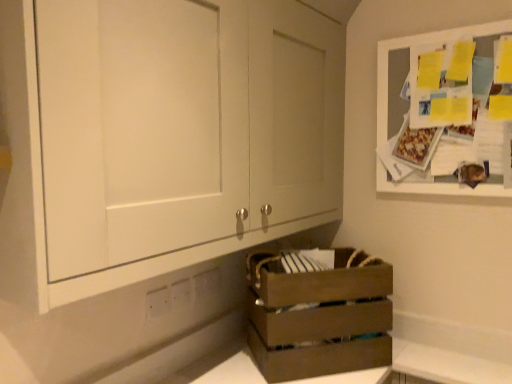
Question: Is brown wooden crate at lower center far away from white plastic electric outlet at lower center, which is the 3th electric outlet in left-to-right order?

Choices:
 (A) no
 (B) yes

Answer: (A)

Question: From a real-world perspective, does brown wooden crate at lower center stand above white plastic electric outlet at lower center, which is the 3th electric outlet in left-to-right order?

Choices:
 (A) yes
 (B) no

Answer: (B)

Question: Is brown wooden crate at lower center not within white plastic electric outlet at lower center, the first electric outlet positioned from the back?

Choices:
 (A) yes
 (B) no

Answer: (A)

Question: Can you confirm if brown wooden crate at lower center is positioned to the left of white plastic electric outlet at lower center, placed as the 1th electric outlet when sorted from right to left?

Choices:
 (A) yes
 (B) no

Answer: (B)

Question: Is brown wooden crate at lower center in contact with white plastic electric outlet at lower center, placed as the 1th electric outlet when sorted from right to left?

Choices:
 (A) yes
 (B) no

Answer: (B)

Question: Is brown wooden crate at lower center further to the viewer compared to white plastic electric outlet at lower center, the first electric outlet positioned from the back?

Choices:
 (A) no
 (B) yes

Answer: (A)

Question: Is matte white cabinet at center, the 1th cabinetry in the left-to-right sequence, at the left side of brown wooden crate at lower center?

Choices:
 (A) no
 (B) yes

Answer: (B)

Question: From the image's perspective, is matte white cabinet at center, the 1th cabinetry in the left-to-right sequence, on brown wooden crate at lower center?

Choices:
 (A) no
 (B) yes

Answer: (B)

Question: Is matte white cabinet at center, the 1th cabinetry in the left-to-right sequence, facing towards brown wooden crate at lower center?

Choices:
 (A) no
 (B) yes

Answer: (A)

Question: Does matte white cabinet at center, the 1th cabinetry in the left-to-right sequence, have a lesser height compared to brown wooden crate at lower center?

Choices:
 (A) no
 (B) yes

Answer: (A)

Question: Does matte white cabinet at center, the 1th cabinetry in the left-to-right sequence, contain brown wooden crate at lower center?

Choices:
 (A) yes
 (B) no

Answer: (B)

Question: Can you confirm if matte white cabinet at center, placed as the second cabinetry when sorted from right to left, is bigger than brown wooden crate at lower center?

Choices:
 (A) yes
 (B) no

Answer: (A)

Question: Is white plastic electric outlet at lower center, placed as the 1th electric outlet when sorted from right to left, to the left of brown wooden crate at lower center from the viewer's perspective?

Choices:
 (A) yes
 (B) no

Answer: (A)